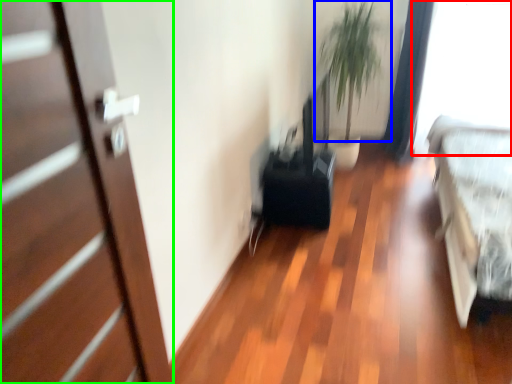
Question: Based on their relative distances, which object is nearer to window screen (highlighted by a red box)? Choose from plant (highlighted by a blue box) and door (highlighted by a green box).

Choices:
 (A) plant
 (B) door

Answer: (A)